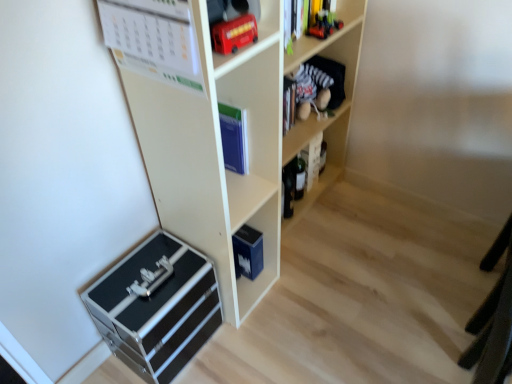
Identify the location of free spot to the right of matte black toolbox at lower left, placed as the second shelf when sorted from bottom to top. The image size is (512, 384). (307, 291).